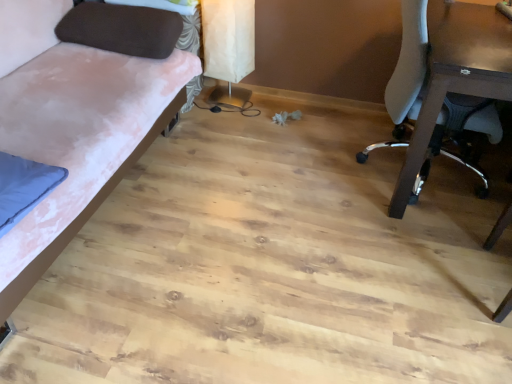
The height and width of the screenshot is (384, 512). Identify the location of vacant space in front of white mesh chair at right. (415, 258).